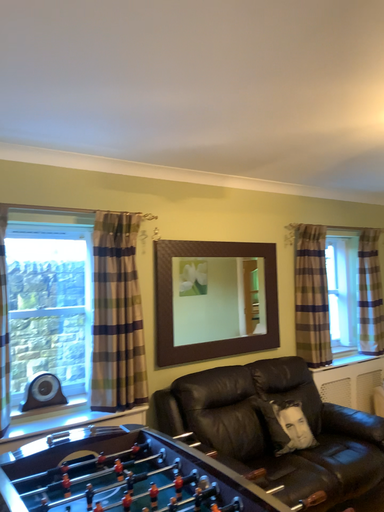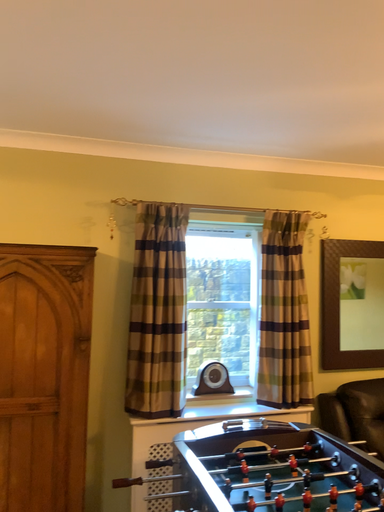
Question: How did the camera likely rotate when shooting the video?

Choices:
 (A) rotated left
 (B) rotated right

Answer: (A)